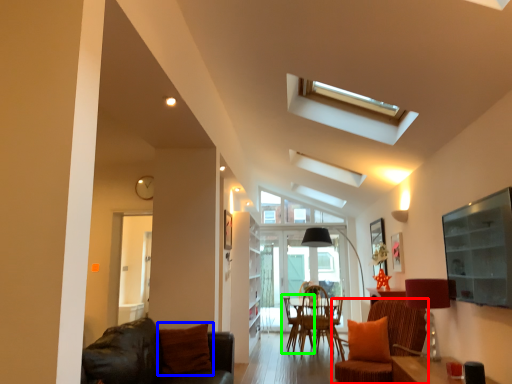
Question: Which object is positioned closest to chair (highlighted by a red box)? Select from pillow (highlighted by a blue box) and armchair (highlighted by a green box).

Choices:
 (A) pillow
 (B) armchair

Answer: (A)